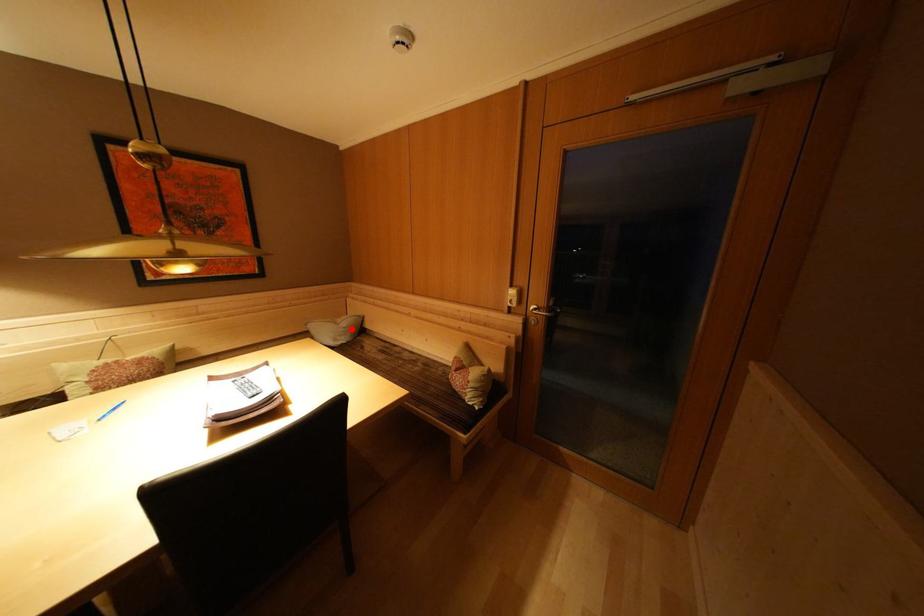
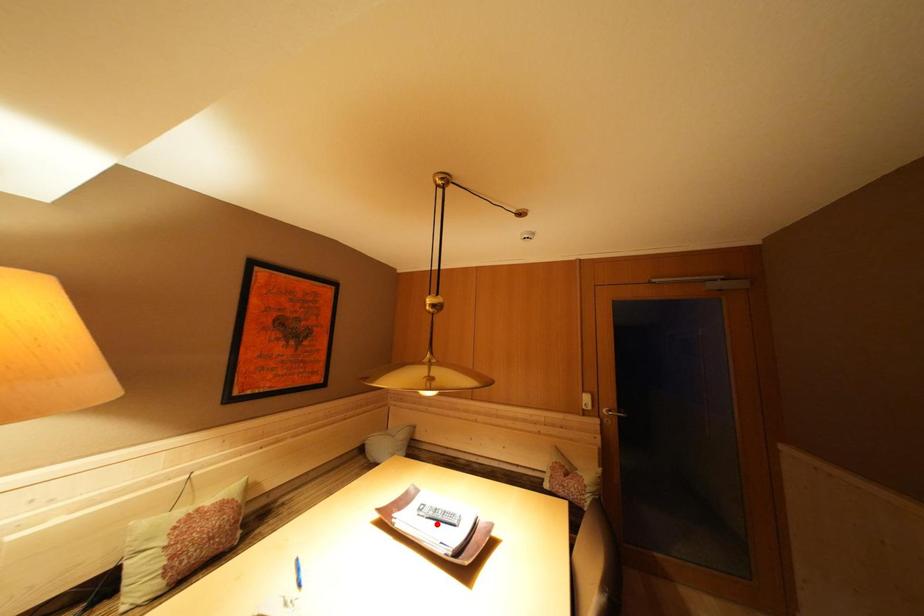
I am providing you with two images of the same scene from different viewpoints. A red point is marked on the first image and another point is marked on the second image. Is the red point in image1 aligned with the point shown in image2?

No